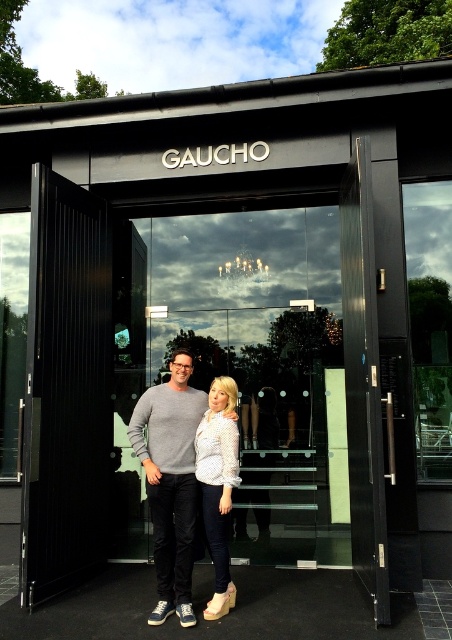
Can you confirm if light gray sweater at center is bigger than white dotted shirt at center?

Indeed, light gray sweater at center has a larger size compared to white dotted shirt at center.

Who is lower down, light gray sweater at center or white dotted shirt at center?

white dotted shirt at center is lower down.

Find the location of a particular element. This screenshot has width=452, height=640. light gray sweater at center is located at coordinates (170, 481).

Does transparent glass door at center lie in front of white dotted shirt at center?

No.

Which is below, transparent glass door at center or white dotted shirt at center?

Positioned lower is white dotted shirt at center.

Which is in front, point (253, 275) or point (229, 582)?

Point (229, 582)

Find the location of a particular element. The image size is (452, 640). transparent glass door at center is located at coordinates (245, 371).

Does transparent glass door at center appear over light gray sweater at center?

Yes, transparent glass door at center is above light gray sweater at center.

The height and width of the screenshot is (640, 452). What do you see at coordinates (245, 371) in the screenshot?
I see `transparent glass door at center` at bounding box center [245, 371].

Where is `transparent glass door at center`? This screenshot has width=452, height=640. transparent glass door at center is located at coordinates (245, 371).